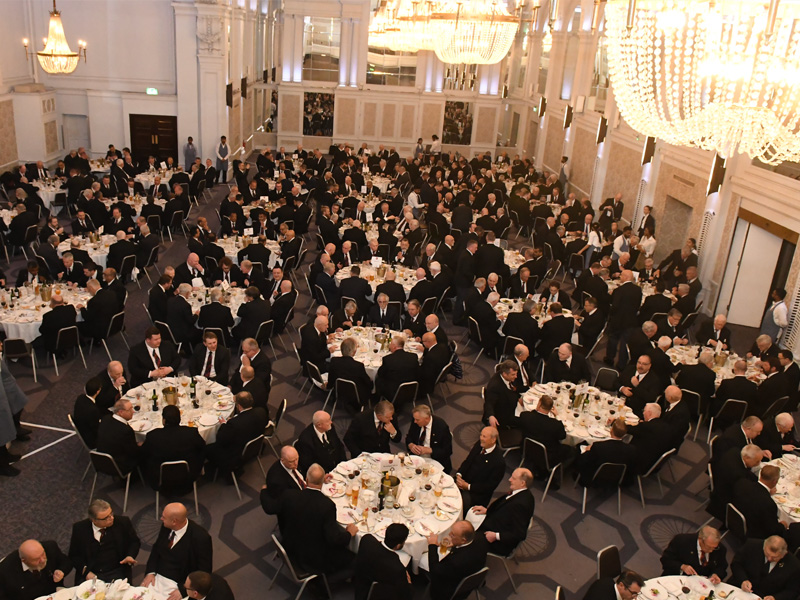
The height and width of the screenshot is (600, 800). I want to click on carpet, so click(x=58, y=499).